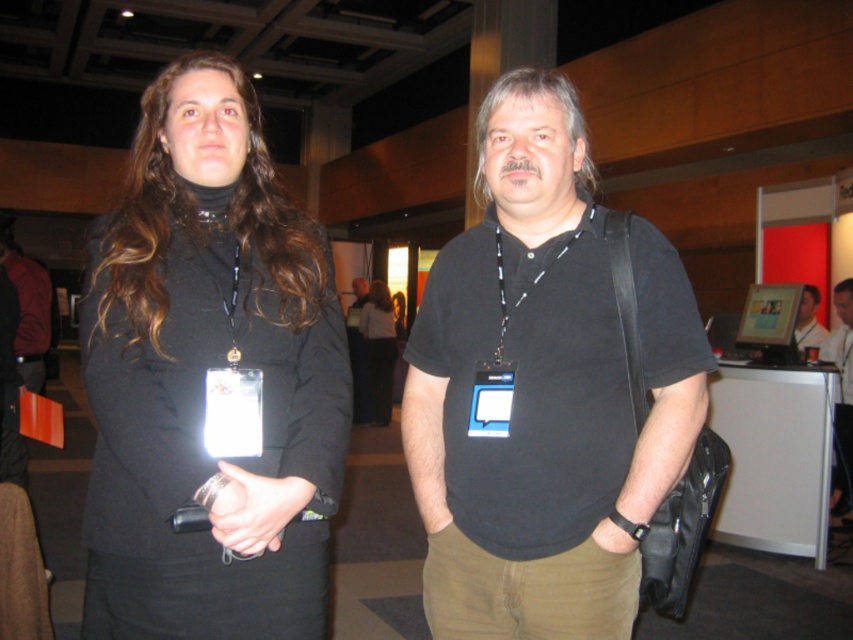
Is point (334, 420) closer to camera compared to point (850, 276)?

Yes, it is.

Consider the image. Is matte black jacket at left taller than black matte shirt at center?

Yes, matte black jacket at left is taller than black matte shirt at center.

Who is more distant from viewer, (320, 528) or (834, 509)?

Positioned behind is point (834, 509).

You are a GUI agent. You are given a task and a screenshot of the screen. Output one action in this format:
    pyautogui.click(x=<x>, y=<y>)
    Task: Click on the matte black jacket at left
    
    Given the screenshot: What is the action you would take?
    pyautogui.click(x=204, y=376)

Does black fabric jacket at center have a lesser height compared to black matte shirt at center?

No, black fabric jacket at center is not shorter than black matte shirt at center.

Does point (370, 368) come in front of point (849, 388)?

No, it is not.

Measure the distance between point (380, 353) and camera.

A distance of 28.24 feet exists between point (380, 353) and camera.

Locate an element on the screen. This screenshot has width=853, height=640. black fabric jacket at center is located at coordinates (379, 349).

Is matte black jacket at left shorter than matte black shirt at center?

Incorrect, matte black jacket at left's height does not fall short of matte black shirt at center's.

From the picture: Is matte black jacket at left thinner than matte black shirt at center?

In fact, matte black jacket at left might be wider than matte black shirt at center.

This screenshot has height=640, width=853. I want to click on matte black jacket at left, so (x=204, y=376).